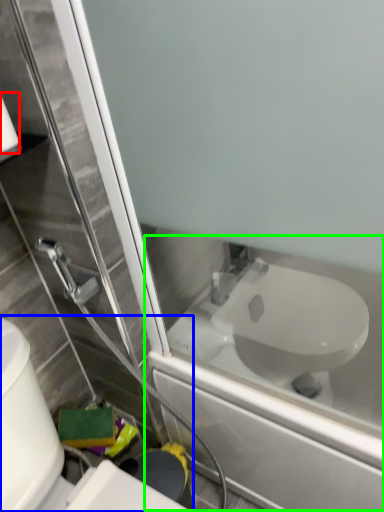
Question: Estimate the real-world distances between objects in this image. Which object is farther from toilet paper (highlighted by a red box), toilet (highlighted by a blue box) or bath (highlighted by a green box)?

Choices:
 (A) toilet
 (B) bath

Answer: (B)